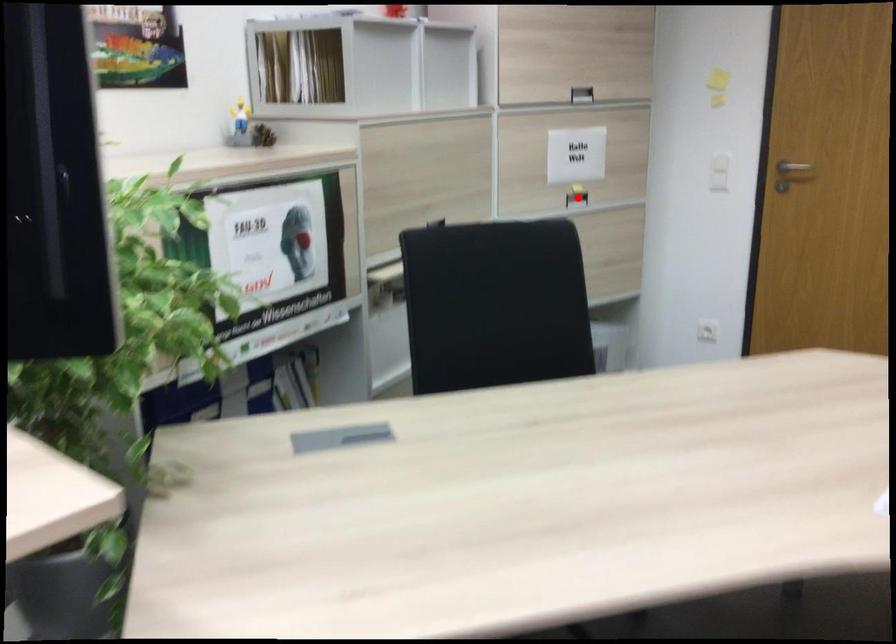
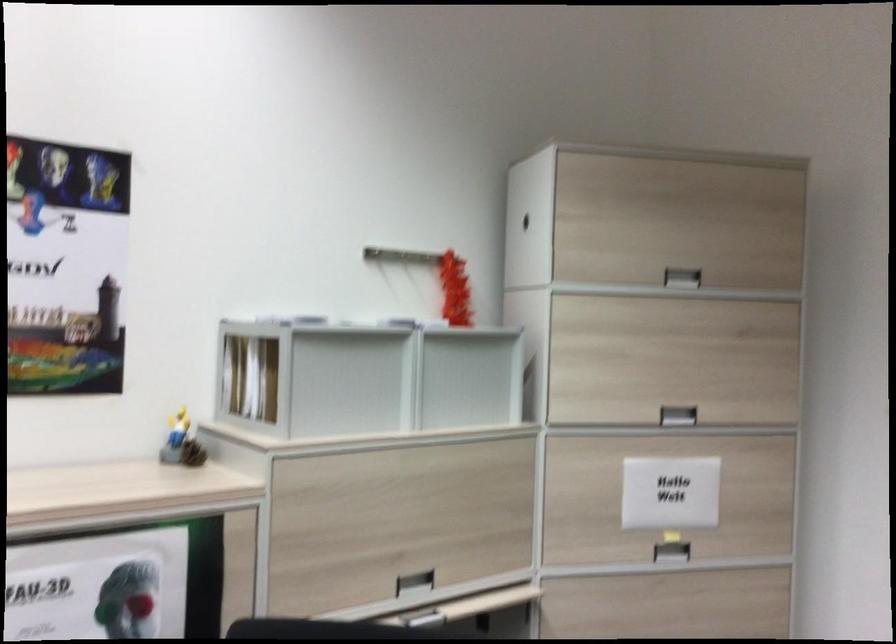
Question: A red point is marked in image1. In image2, is the corresponding 3D point closer to the camera or farther? Reply with the corresponding letter.

Choices:
 (A) The corresponding 3D point is closer.
 (B) The corresponding 3D point is farther.

Answer: (A)